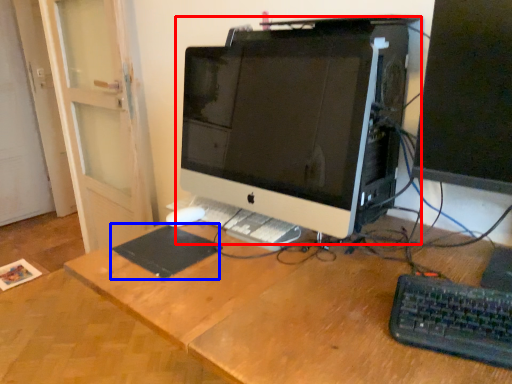
Question: Among these objects, which one is farthest to the camera, computer monitor (highlighted by a red box) or mousepad (highlighted by a blue box)?

Choices:
 (A) computer monitor
 (B) mousepad

Answer: (B)